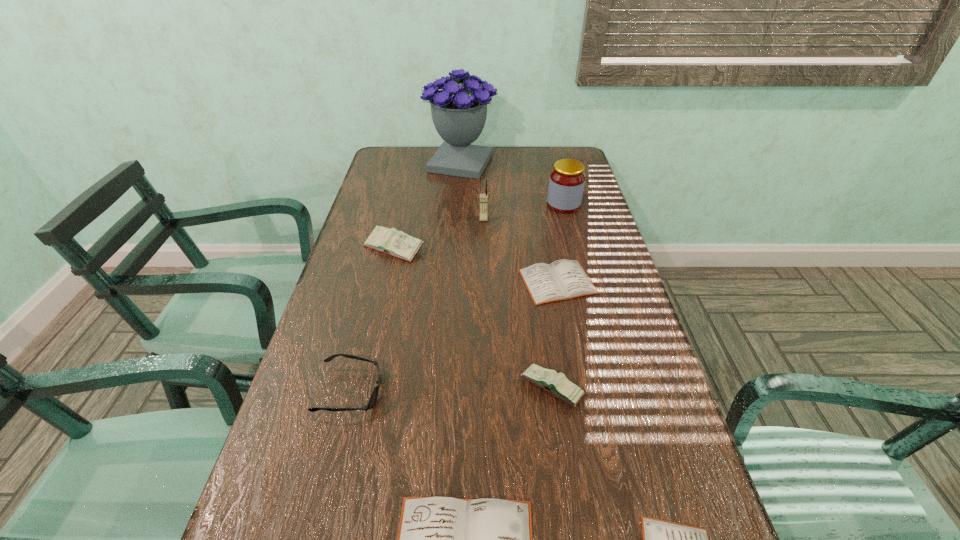
You are a GUI agent. You are given a task and a screenshot of the screen. Output one action in this format:
    pyautogui.click(x=<x>, y=<y>)
    Task: Click on the blank region between the second shortest diary and the bouquet
    The height and width of the screenshot is (540, 960).
    Given the screenshot: What is the action you would take?
    pyautogui.click(x=510, y=222)

Image resolution: width=960 pixels, height=540 pixels. Identify the location of free space between the nearer pink diary and the sunglasses. (451, 390).

The width and height of the screenshot is (960, 540). Identify the location of free spot between the purple bouquet and the black sunglasses. (406, 277).

I want to click on object that is the fifth closest to the second smallest white diary, so click(374, 395).

Identify which object is located as the fourth nearest to the shortest object. Please provide its 2D coordinates. Your answer should be formatted as a tuple, i.e. [(x, y)], where the tuple contains the x and y coordinates of a point satisfying the conditions above.

[(563, 279)]

Identify the location of the third closest diary relative to the bigger pink diary. (440, 539).

The image size is (960, 540). In order to click on the fifth closest diary to the cellular telephone in this screenshot , I will do `click(662, 539)`.

The image size is (960, 540). I want to click on white diary that stands as the second closest to the cellular telephone, so click(x=440, y=539).

In order to click on the second closest white diary to the leftmost white diary in this screenshot , I will do `click(563, 279)`.

The height and width of the screenshot is (540, 960). I want to click on vacant point that satisfies the following two spatial constraints: 1. on the back side of the leftmost diary; 2. on the right side of the tallest object, so click(x=414, y=163).